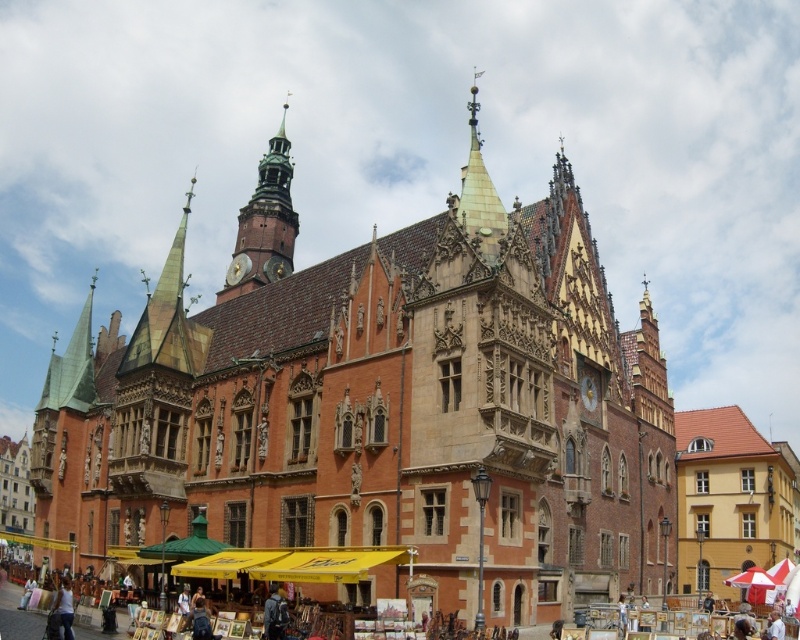
You are standing in a park across from the matte brick church at center. You want to take a photo of the church with your smartphone. The recommended distance for clear photos is at least 50 meters. Can you take a clear photo from your current position?

The matte brick church at center is 59.06 meters from viewer, which is more than the recommended 50 meters. Therefore, you can take a clear photo from your current position.

You are standing in front of the grand Gothic building and notice two points marked on its facade. The first point is at coordinates point (384, 547), and the second is at point (274, 634). Which of these points is closer to the viewer?

Point (274, 634) is closer to the viewer because it is in front of point (384, 547), which is behind it.